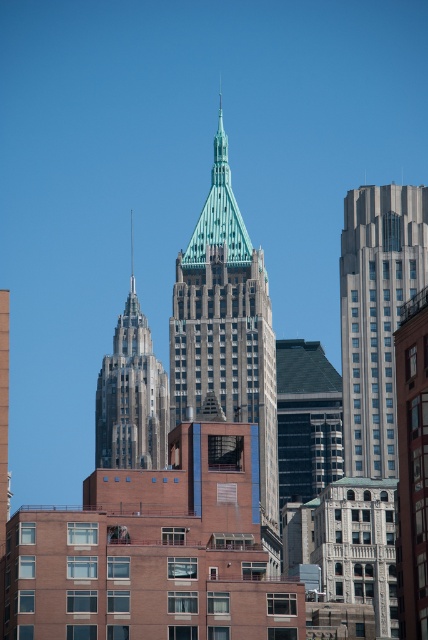
Can you confirm if green stone tower at center is wider than gray stone skyscraper at right?

Indeed, green stone tower at center has a greater width compared to gray stone skyscraper at right.

Which is in front, point (259, 508) or point (410, 184)?

Positioned in front is point (259, 508).

Is point (213, 356) positioned behind point (425, 225)?

Yes.

You are a GUI agent. You are given a task and a screenshot of the screen. Output one action in this format:
    pyautogui.click(x=<x>, y=<y>)
    Task: Click on the green stone tower at center
    
    Given the screenshot: What is the action you would take?
    pyautogui.click(x=226, y=332)

Is gray stone skyscraper at right below gray stone tower at left?

Actually, gray stone skyscraper at right is above gray stone tower at left.

Is the position of gray stone skyscraper at right less distant than that of gray stone tower at left?

Yes, gray stone skyscraper at right is in front of gray stone tower at left.

Which is behind, point (377, 211) or point (133, 364)?

The point (133, 364) is behind.

This screenshot has height=640, width=428. In order to click on gray stone skyscraper at right in this screenshot , I will do `click(377, 314)`.

Who is taller, green stone tower at center or gray stone tower at left?

With more height is green stone tower at center.

Does green stone tower at center have a lesser height compared to gray stone tower at left?

No, green stone tower at center is not shorter than gray stone tower at left.

Is point (175, 328) positioned behind point (133, 348)?

No, it is not.

The height and width of the screenshot is (640, 428). In order to click on green stone tower at center in this screenshot , I will do `click(226, 332)`.